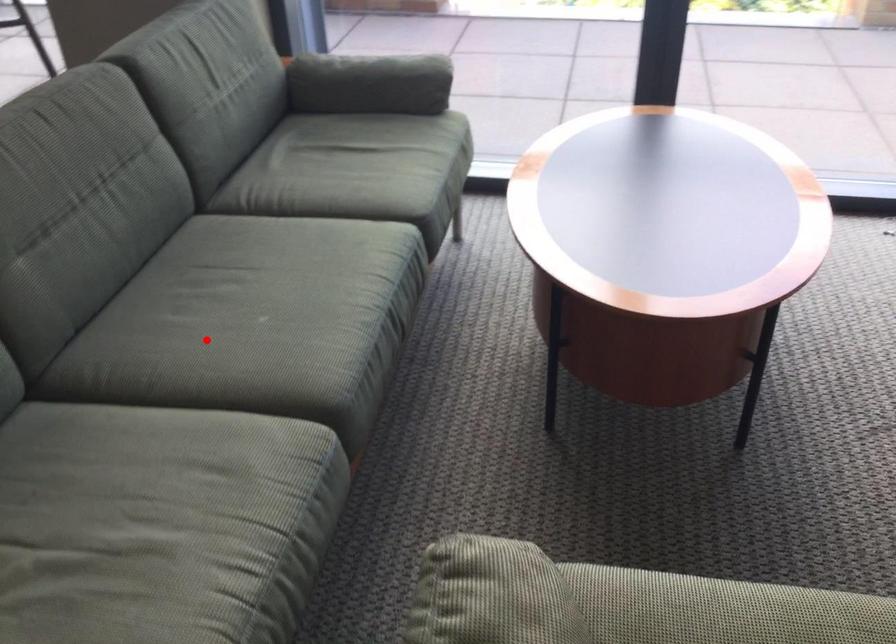
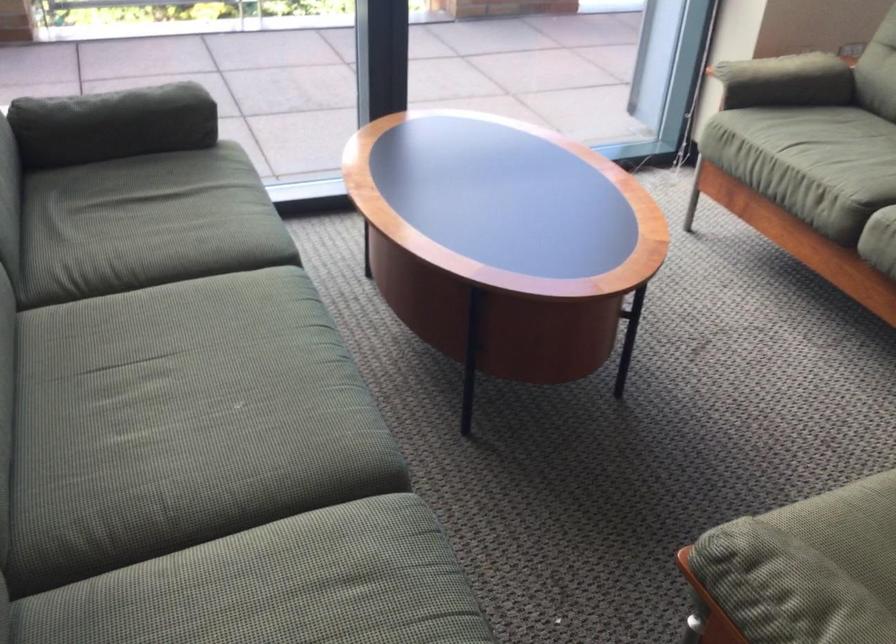
Question: I am providing you with two images of the same scene from different viewpoints. Given a red point in image1, look at the same physical point in image2. Is it:

Choices:
 (A) Closer to the viewpoint
 (B) Farther from the viewpoint

Answer: (A)